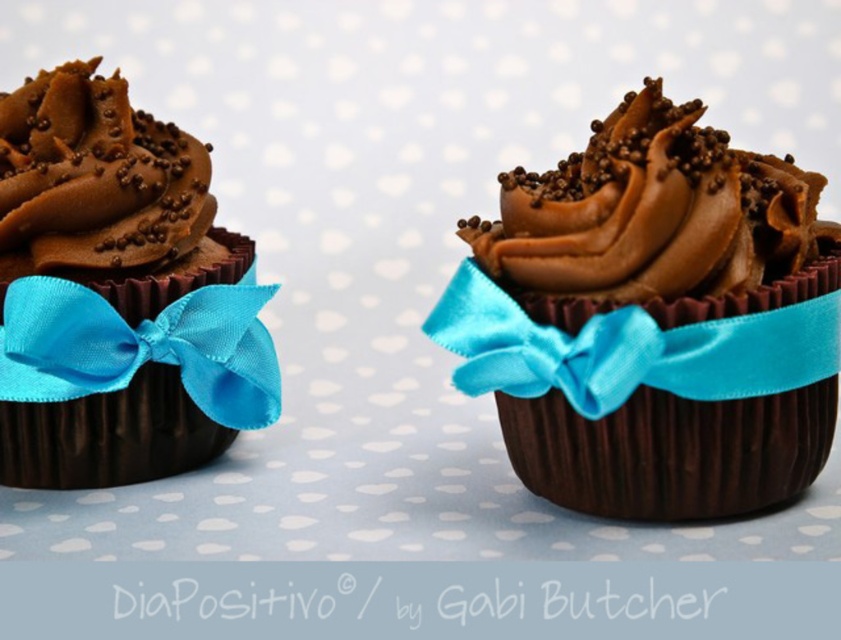
You are a baker who wants to ensure uniformity in your cupcakes. You have two chocolatesmoothcupcake at right and chocolatesmoothcupcake at left. Which one has a greater width?

The chocolatesmoothcupcake at right has a greater width than the chocolatesmoothcupcake at left.

You are planning to decorate a cake table and need to arrange these two items from left to right. Given that you have the chocolatesmoothcupcake at right and turquoise satin ribbon at left, which item should be placed first on the left side of the table?

The turquoise satin ribbon at left should be placed first on the left side of the table since the chocolatesmoothcupcake at right is positioned to its right in the image.

From the picture: You are a baker who needs to choose the larger ribbon to decorate a cake. Looking at the two turquoise satin ribbon at right and turquoise satin ribbon at left on the cupcakes, which one should you pick?

The turquoise satin ribbon at left is larger than the turquoise satin ribbon at right, so you should pick the turquoise satin ribbon at left.